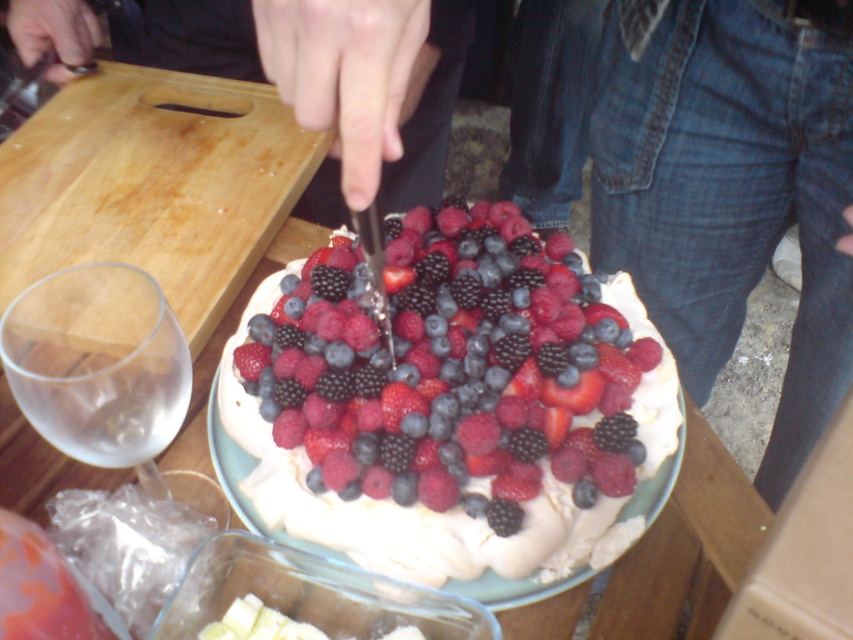
You are preparing to place a new recipe book on the table. The book is 15 cm wide. You see the jeans at center and the wooden cutting board at upper left. Which object can the book fit on without overhanging?

The wooden cutting board at upper left can fit the 15 cm wide book without overhanging since its width is greater than the jeans at center.

You are looking at the pavlova dessert being cut. There are two points marked on the image. One is at coordinate point (x=33, y=419) and the other is at point (x=463, y=54). Which point is closer to you?

Point (x=33, y=419) is closer to the camera than point (x=463, y=54).